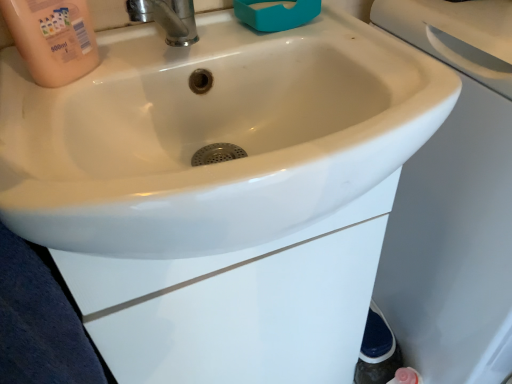
Question: In terms of size, does pink matte bottle at upper left appear bigger or smaller than white glossy sink at center?

Choices:
 (A) big
 (B) small

Answer: (B)

Question: Considering the relative positions of pink matte bottle at upper left and white glossy sink at center in the image provided, is pink matte bottle at upper left to the left or to the right of white glossy sink at center?

Choices:
 (A) right
 (B) left

Answer: (B)

Question: Considering the real-world distances, which object is farthest from the white glossy sink at center?

Choices:
 (A) pink matte bottle at upper left
 (B) polished chrome tap at upper center

Answer: (A)

Question: Which object is positioned closest to the white glossy sink at center?

Choices:
 (A) pink matte bottle at upper left
 (B) polished chrome tap at upper center

Answer: (B)